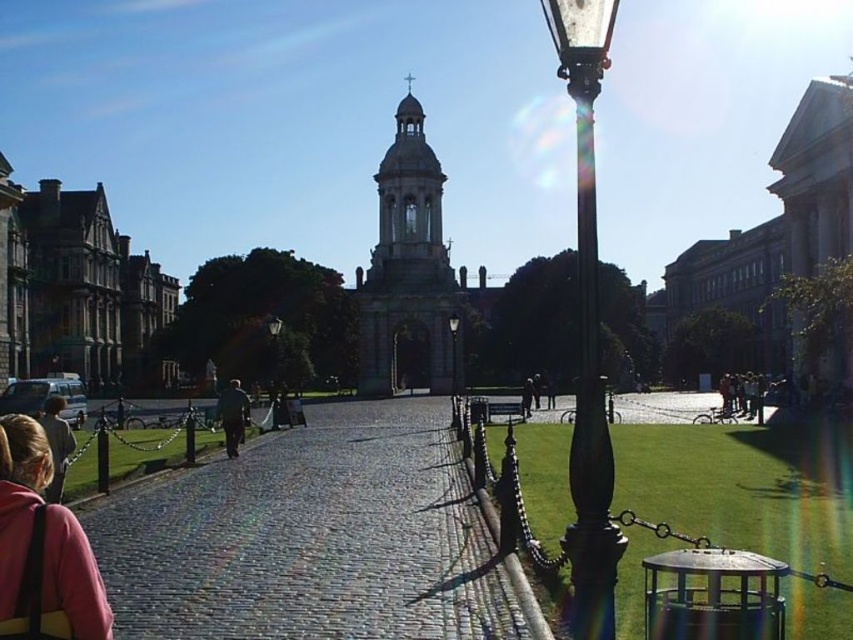
Question: Which of these objects is positioned farthest from the metallic street light at center?

Choices:
 (A) pink fabric backpack at lower left
 (B) cobblestone path at center
 (C) smooth stone tower at center

Answer: (A)

Question: Can you confirm if pink fabric backpack at lower left is bigger than polished brass street light at center?

Choices:
 (A) no
 (B) yes

Answer: (B)

Question: Considering the relative positions of black polished metal street light at center right and metallic street light at center in the image provided, where is black polished metal street light at center right located with respect to metallic street light at center?

Choices:
 (A) left
 (B) right

Answer: (B)

Question: Estimate the real-world distances between objects in this image. Which object is farther from the smooth stone tower at center?

Choices:
 (A) cobblestone path at center
 (B) pink fabric backpack at lower left

Answer: (B)

Question: Which point is farther from the camera taking this photo?

Choices:
 (A) (142, 605)
 (B) (234, 426)
 (C) (62, 406)
 (D) (425, 198)

Answer: (D)

Question: Where is smooth stone tower at center located in relation to metallic street light at center in the image?

Choices:
 (A) below
 (B) above

Answer: (B)